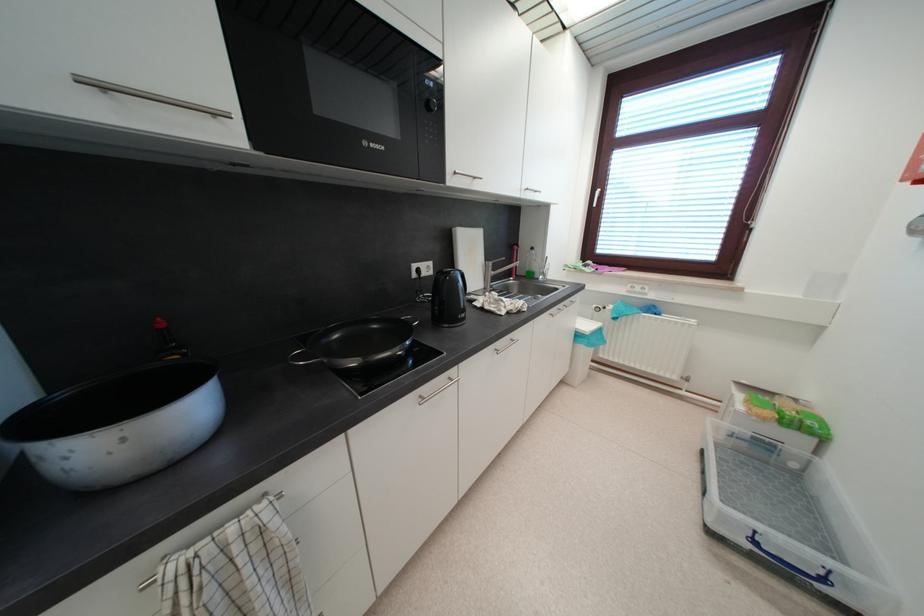
The width and height of the screenshot is (924, 616). What do you see at coordinates (149, 95) in the screenshot? I see `the white window handle` at bounding box center [149, 95].